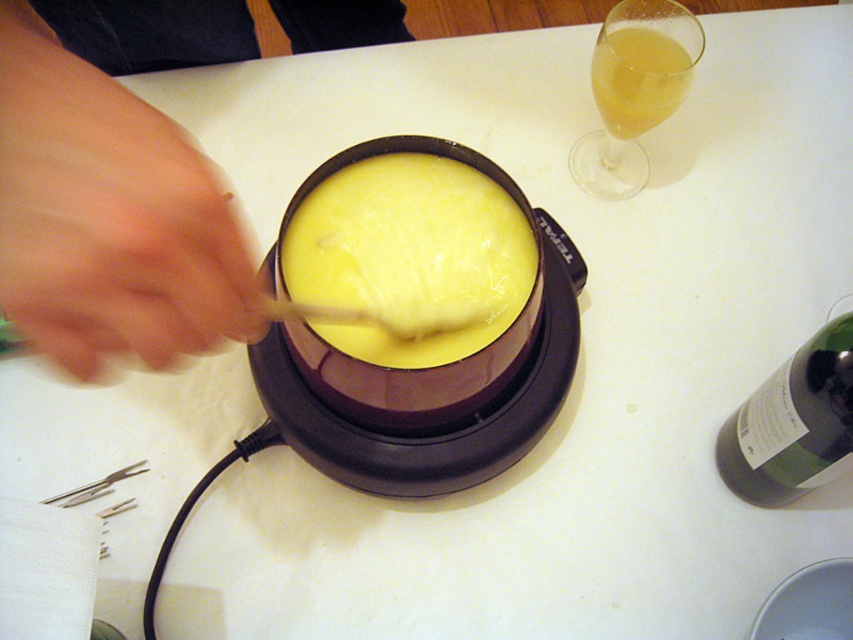
Question: Which point appears farthest from the camera in this image?

Choices:
 (A) (457, 468)
 (B) (790, 387)
 (C) (44, 58)

Answer: (A)

Question: Observing the image, what is the correct spatial positioning of skinny wooden stick at left in reference to translucent glass at upper right?

Choices:
 (A) right
 (B) left

Answer: (B)

Question: Estimate the real-world distances between objects in this image. Which object is closer to the yellow creamy cheese at center?

Choices:
 (A) skinny wooden stick at left
 (B) green glass bottle at right

Answer: (B)

Question: Which of the following is the farthest from the observer?

Choices:
 (A) (477, 472)
 (B) (608, 92)

Answer: (B)

Question: Is skinny wooden stick at left positioned at the back of yellow creamy cheese at center?

Choices:
 (A) yes
 (B) no

Answer: (A)

Question: Can you confirm if skinny wooden stick at left is wider than yellow creamy cheese at center?

Choices:
 (A) yes
 (B) no

Answer: (A)